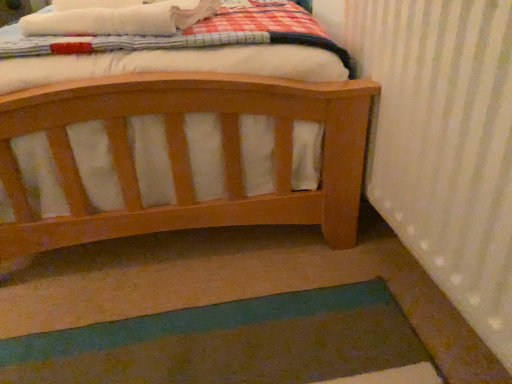
Where is `vacant region to the left of white textured radiator at right`? vacant region to the left of white textured radiator at right is located at coordinates point(245,289).